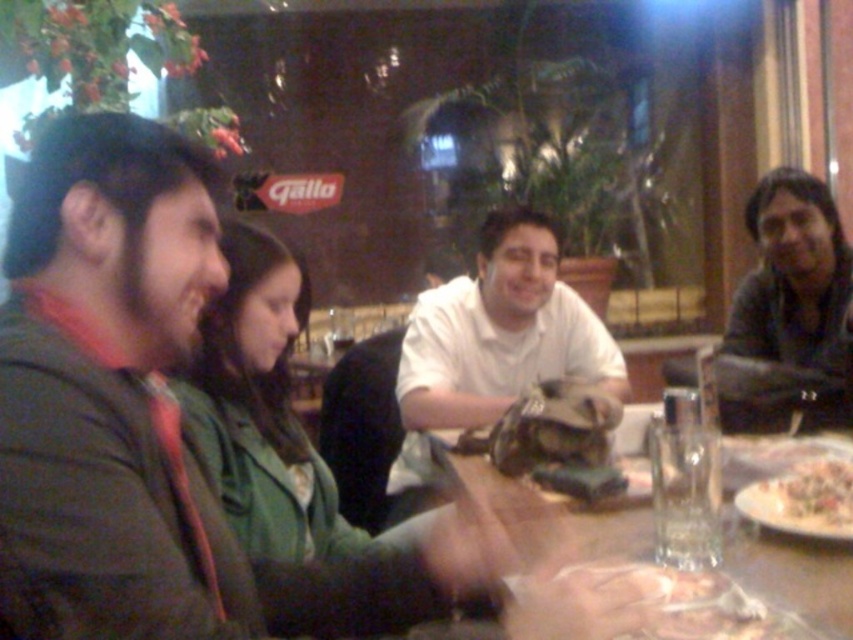
You are a waiter in a restaurant. You see the dark gray sweater at upper right and the transparent glass at center. Which object is closer to the customer sitting at the table?

The dark gray sweater at upper right is closer to the customer sitting at the table because the transparent glass at center is behind it.

You are a waiter in a restaurant. You need to place a 70 cm long tray between the white matte shirt at center and the transparent glass at center. Can you fit the tray between them without it overlapping either object?

The distance between the white matte shirt at center and the transparent glass at center is 66.67 centimeters. Since the tray is 70 cm long, it is longer than the available space, so the tray cannot be placed between them without overlapping either object.

You are a waiter in a restaurant and need to deliver a dessert to the table. The dessert must be placed on the table without blocking the transparent glass at center or the white creamy pasta at lower right. Where should you place the dessert?

The dessert should be placed in an area of the table that is not occupied by either the transparent glass at center or the white creamy pasta at lower right. Since the transparent glass at center is in front of the white creamy pasta at lower right, placing the dessert behind the white creamy pasta at lower right or to the side of the transparent glass at center would ensure it doesn t block either item.